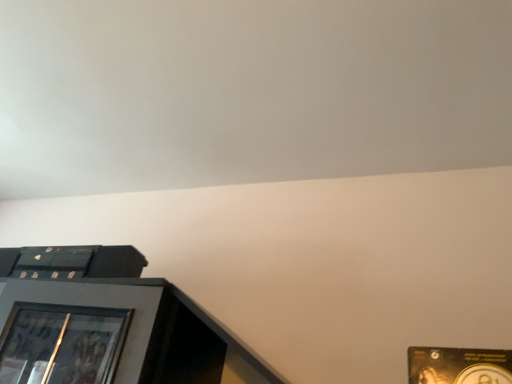
What do you see at coordinates (459, 365) in the screenshot? This screenshot has height=384, width=512. I see `gold metallic plaque at lower right` at bounding box center [459, 365].

Measure the distance between gold metallic plaque at lower right and camera.

gold metallic plaque at lower right is 26.50 inches from camera.

The width and height of the screenshot is (512, 384). Find the location of `gold metallic plaque at lower right`. gold metallic plaque at lower right is located at coordinates (459, 365).

Identify the location of gold metallic plaque at lower right. (459, 365).